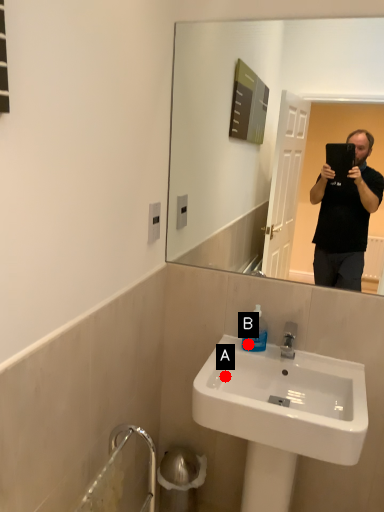
Question: Two points are circled on the image, labeled by A and B beside each circle. Which point appears farthest from the camera in this image?

Choices:
 (A) A is further
 (B) B is further

Answer: (B)